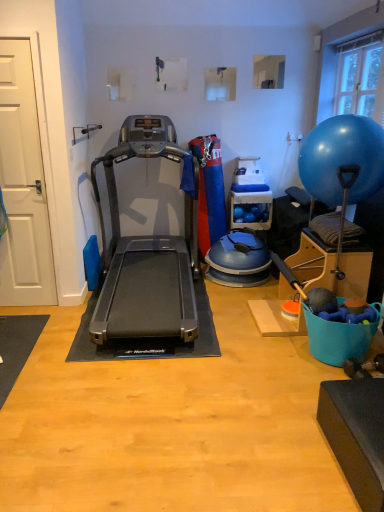
Question: From a real-world perspective, is transparent glass window at upper right located higher than black rubber treadmill at center?

Choices:
 (A) no
 (B) yes

Answer: (B)

Question: Are transparent glass window at upper right and black rubber treadmill at center making contact?

Choices:
 (A) yes
 (B) no

Answer: (B)

Question: Can you confirm if transparent glass window at upper right is taller than black rubber treadmill at center?

Choices:
 (A) yes
 (B) no

Answer: (B)

Question: Is transparent glass window at upper right to the left of black rubber treadmill at center from the viewer's perspective?

Choices:
 (A) no
 (B) yes

Answer: (A)

Question: Does transparent glass window at upper right lie in front of black rubber treadmill at center?

Choices:
 (A) yes
 (B) no

Answer: (B)

Question: From the image's perspective, is transparent glass window at upper right on black rubber treadmill at center?

Choices:
 (A) no
 (B) yes

Answer: (B)

Question: From a real-world perspective, is blue rubber ball at right under black rubber treadmill at center?

Choices:
 (A) yes
 (B) no

Answer: (B)

Question: Is blue rubber ball at right far away from black rubber treadmill at center?

Choices:
 (A) yes
 (B) no

Answer: (A)

Question: Is blue rubber ball at right not inside black rubber treadmill at center?

Choices:
 (A) no
 (B) yes

Answer: (B)

Question: Is blue rubber ball at right further to camera compared to black rubber treadmill at center?

Choices:
 (A) yes
 (B) no

Answer: (A)

Question: From the image's perspective, does blue rubber ball at right appear lower than black rubber treadmill at center?

Choices:
 (A) no
 (B) yes

Answer: (A)

Question: Does blue rubber ball at right appear on the left side of black rubber treadmill at center?

Choices:
 (A) no
 (B) yes

Answer: (A)

Question: Does black rubber treadmill at center have a greater height compared to transparent glass window at upper right?

Choices:
 (A) yes
 (B) no

Answer: (A)